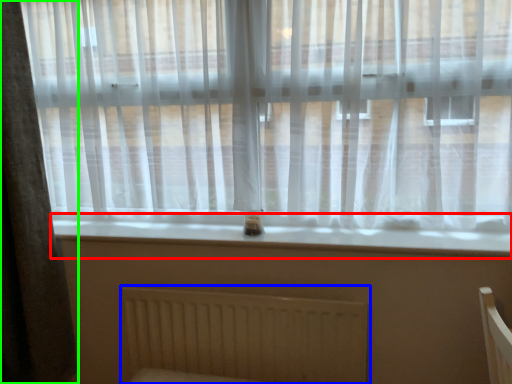
Question: Which object is positioned farthest from window sill (highlighted by a red box)? Select from radiator (highlighted by a blue box) and curtain (highlighted by a green box).

Choices:
 (A) radiator
 (B) curtain

Answer: (B)